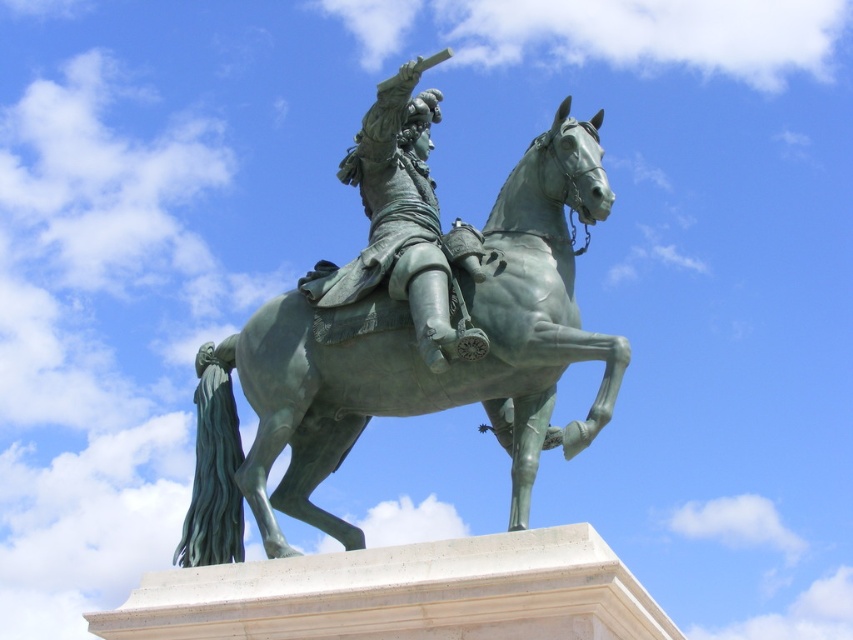
You are an art student standing in front of the green polished bronze statue at center and the green polished metal horse at center. Which object is positioned closer to you?

The green polished bronze statue at center is closer to the viewer than the green polished metal horse at center.

You are an art student analyzing the statue. You notice the green polished bronze statue at center and the green polished metal horse at center. Which object is positioned to the right of the other?

The green polished bronze statue at center is positioned to the right of the green polished metal horse at center.